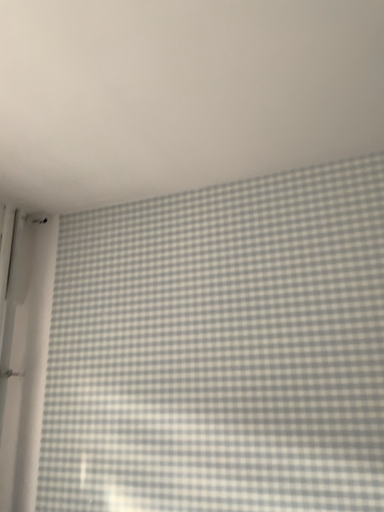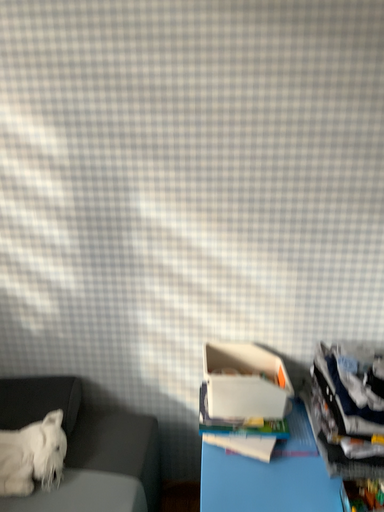
Question: Which way did the camera rotate in the video?

Choices:
 (A) rotated downward
 (B) rotated upward

Answer: (A)